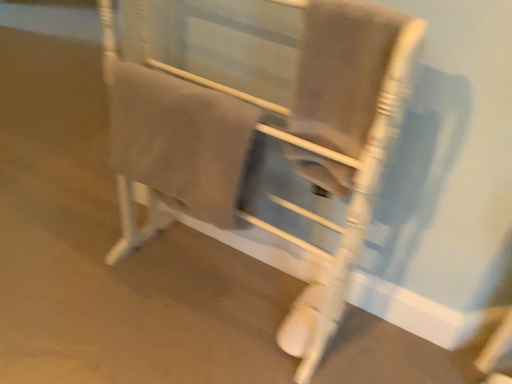
Locate an element on the screen. vacant space in matte white chair at center (from a real-world perspective) is located at coordinates (212, 290).